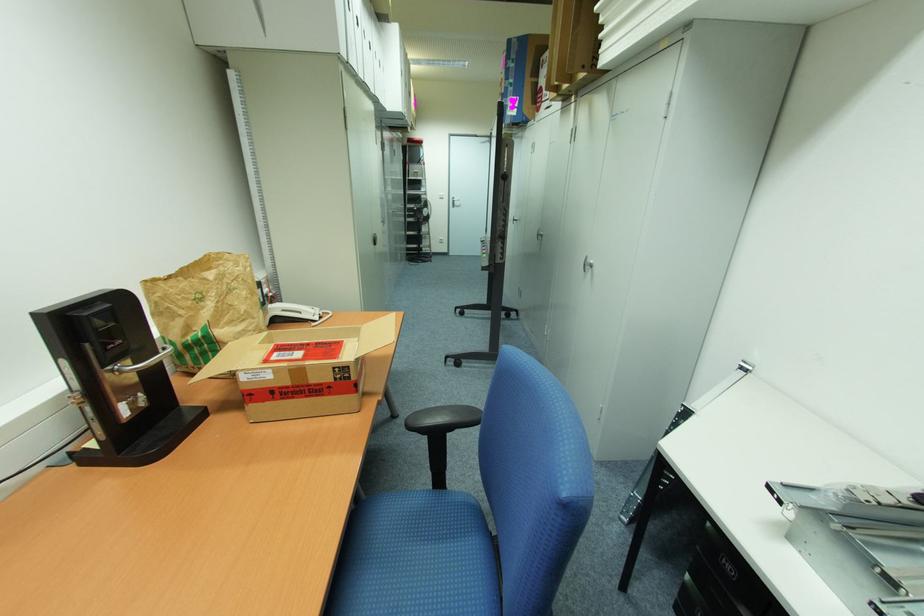
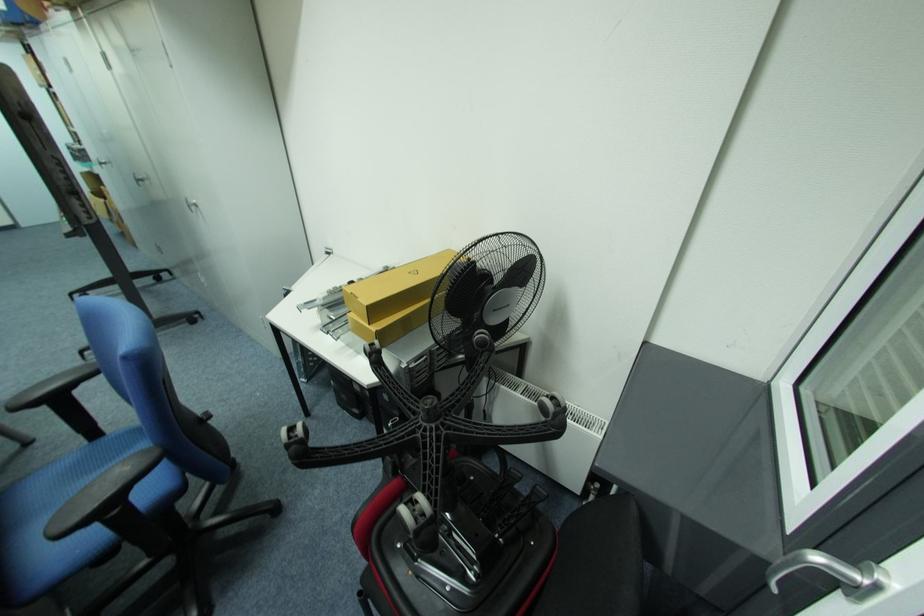
In the second image, find the point that corresponds to [517,221] in the first image.

(105, 164)